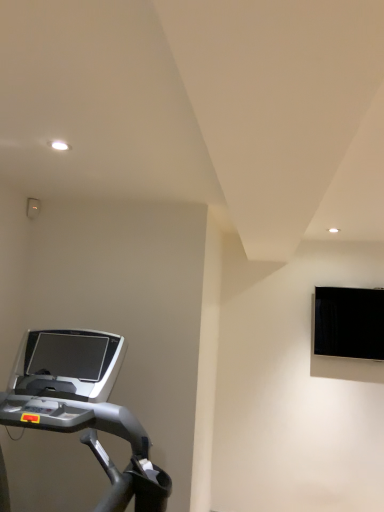
Question: Relative to silver metallic treadmill at lower left, is black glossy monitor at upper right in front or behind?

Choices:
 (A) front
 (B) behind

Answer: (B)

Question: Considering the relative positions of black glossy monitor at upper right and silver metallic treadmill at lower left in the image provided, is black glossy monitor at upper right to the left or to the right of silver metallic treadmill at lower left?

Choices:
 (A) left
 (B) right

Answer: (B)

Question: In terms of size, does black glossy monitor at upper right appear bigger or smaller than silver metallic treadmill at lower left?

Choices:
 (A) small
 (B) big

Answer: (A)

Question: Which is correct: silver metallic treadmill at lower left is inside black glossy monitor at upper right, or outside of it?

Choices:
 (A) inside
 (B) outside

Answer: (B)

Question: Is silver metallic treadmill at lower left wider or thinner than black glossy monitor at upper right?

Choices:
 (A) thin
 (B) wide

Answer: (B)

Question: Is silver metallic treadmill at lower left bigger or smaller than black glossy monitor at upper right?

Choices:
 (A) big
 (B) small

Answer: (A)

Question: From the image's perspective, is silver metallic treadmill at lower left located above or below black glossy monitor at upper right?

Choices:
 (A) above
 (B) below

Answer: (B)